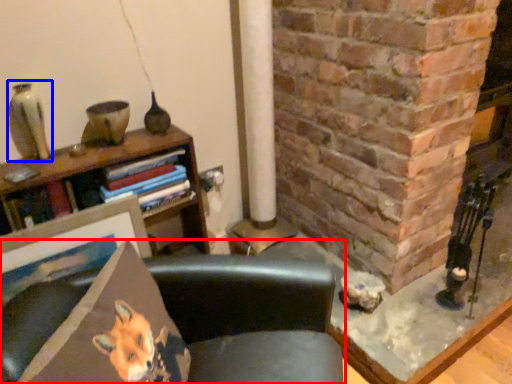
Question: Which object is closer to the camera taking this photo, chair (highlighted by a red box) or gray (highlighted by a blue box)?

Choices:
 (A) chair
 (B) gray

Answer: (A)